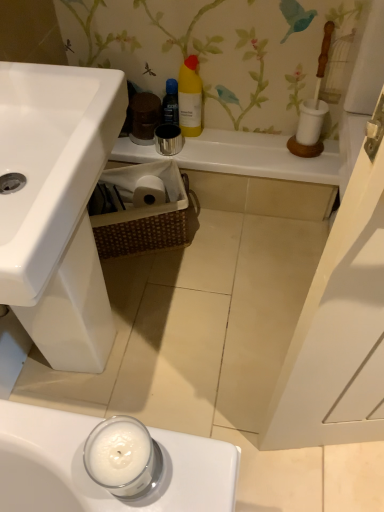
Question: Is yellow plastic bottle at upper center in front of or behind white ceramic counter top at upper center in the image?

Choices:
 (A) behind
 (B) front

Answer: (B)

Question: Is yellow plastic bottle at upper center inside the boundaries of white ceramic counter top at upper center, or outside?

Choices:
 (A) inside
 (B) outside

Answer: (B)

Question: Considering the real-world distances, which object is closest to the yellow plastic bottle at upper center?

Choices:
 (A) black plastic spray can at upper center
 (B) brown woven basket at lower center
 (C) white ceramic counter top at upper center

Answer: (A)

Question: Estimate the real-world distances between objects in this image. Which object is closer to the yellow plastic bottle at upper center?

Choices:
 (A) black plastic spray can at upper center
 (B) brown woven basket at lower center
 (C) white ceramic counter top at upper center

Answer: (A)